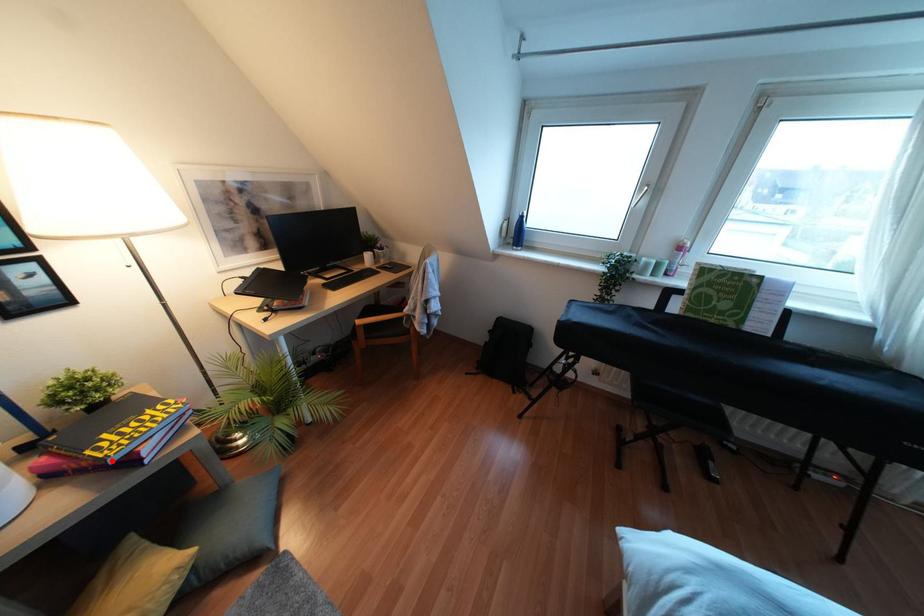
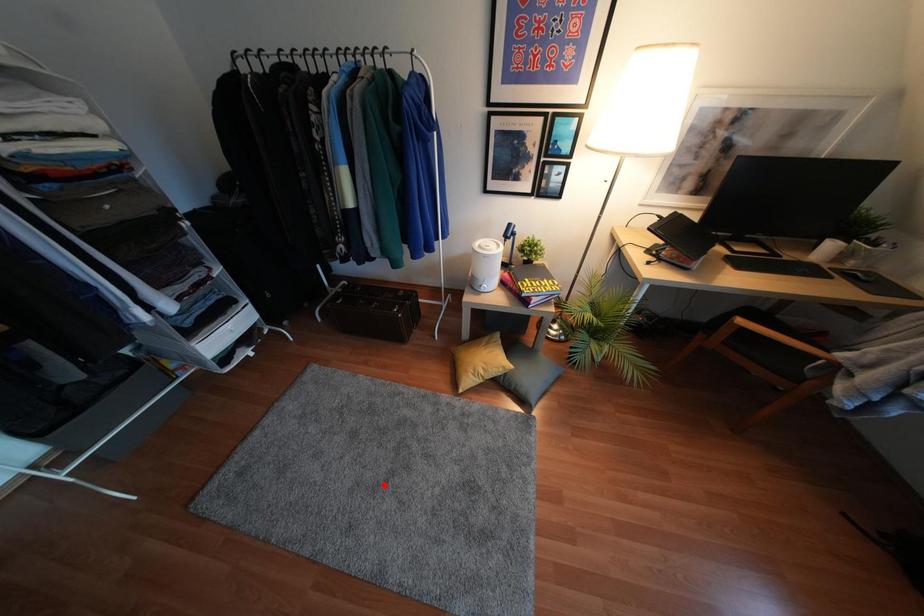
Looking at this image, I am providing you with two images of the same scene from different viewpoints. A red point is marked on the first image and another point is marked on the second image. Are the points marked in image1 and image2 representing the same 3D position?

No